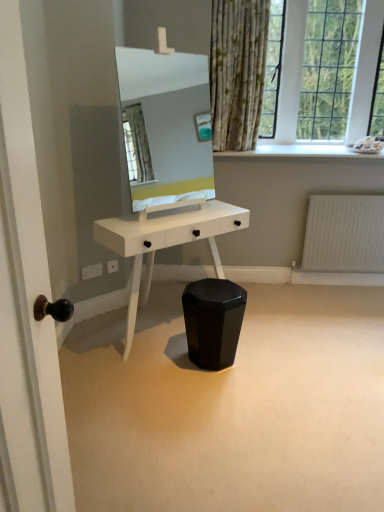
Where is `vacant area located to the right-hand side of black glossy stool at center`? vacant area located to the right-hand side of black glossy stool at center is located at coordinates (270, 364).